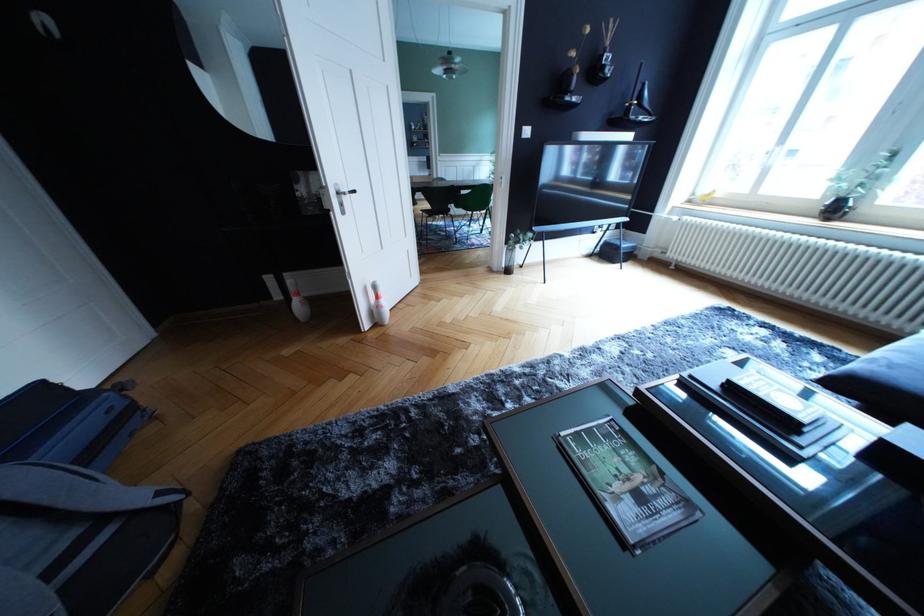
This screenshot has height=616, width=924. I want to click on sofa armrest, so click(884, 379).